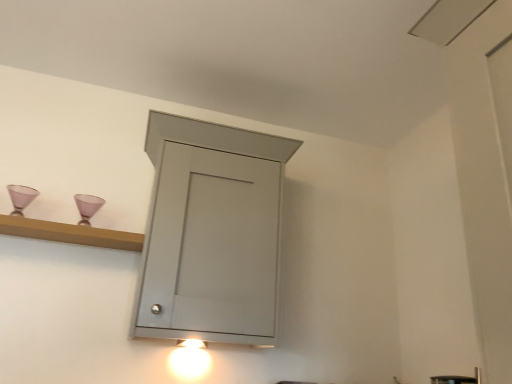
Question: Is satin nickel faucet at lower right wider than matte white light fixture at lower center?

Choices:
 (A) yes
 (B) no

Answer: (A)

Question: Is satin nickel faucet at lower right to the left of matte white light fixture at lower center from the viewer's perspective?

Choices:
 (A) yes
 (B) no

Answer: (B)

Question: Is satin nickel faucet at lower right bigger than matte white light fixture at lower center?

Choices:
 (A) yes
 (B) no

Answer: (B)

Question: Is satin nickel faucet at lower right behind matte white light fixture at lower center?

Choices:
 (A) yes
 (B) no

Answer: (B)

Question: From the image's perspective, is satin nickel faucet at lower right located beneath matte white light fixture at lower center?

Choices:
 (A) yes
 (B) no

Answer: (B)

Question: Is matte gray cabinet at center wider or thinner than wooden shelf at upper left?

Choices:
 (A) thin
 (B) wide

Answer: (B)

Question: Based on their sizes in the image, would you say matte gray cabinet at center is bigger or smaller than wooden shelf at upper left?

Choices:
 (A) big
 (B) small

Answer: (A)

Question: From the image's perspective, is matte gray cabinet at center located above or below wooden shelf at upper left?

Choices:
 (A) above
 (B) below

Answer: (B)

Question: Is matte gray cabinet at center taller or shorter than wooden shelf at upper left?

Choices:
 (A) short
 (B) tall

Answer: (B)

Question: Looking at their shapes, would you say matte gray cabinet at center is wider or thinner than satin nickel faucet at lower right?

Choices:
 (A) wide
 (B) thin

Answer: (A)

Question: Looking at the image, does matte gray cabinet at center seem bigger or smaller compared to satin nickel faucet at lower right?

Choices:
 (A) small
 (B) big

Answer: (B)

Question: From a real-world perspective, is matte gray cabinet at center positioned above or below satin nickel faucet at lower right?

Choices:
 (A) above
 (B) below

Answer: (A)

Question: Considering the relative positions of matte gray cabinet at center and satin nickel faucet at lower right in the image provided, is matte gray cabinet at center to the left or to the right of satin nickel faucet at lower right?

Choices:
 (A) right
 (B) left

Answer: (B)

Question: Considering the positions of point (192, 349) and point (1, 231), is point (192, 349) closer or farther from the camera than point (1, 231)?

Choices:
 (A) farther
 (B) closer

Answer: (A)

Question: Based on their sizes in the image, would you say matte white light fixture at lower center is bigger or smaller than wooden shelf at upper left?

Choices:
 (A) small
 (B) big

Answer: (A)